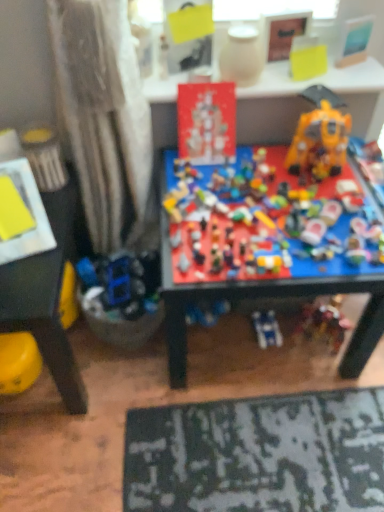
Question: From the image's perspective, is yellow plastic toy at lower left, arranged as the 2th table when viewed from the top, positioned above or below metallic yellow can at left, which is counted as the 1th toy, starting from the left?

Choices:
 (A) above
 (B) below

Answer: (B)

Question: In the image, is yellow plastic toy at lower left, which appears as the first table when ordered from the bottom, positioned in front of or behind metallic yellow can at left, the 6th toy viewed from the right?

Choices:
 (A) front
 (B) behind

Answer: (A)

Question: Which is nearer to the yellow matte paper at upper center, positioned as the 5th toy in left-to-right order?

Choices:
 (A) matte red poster at center, the fifth toy in the right-to-left sequence
 (B) multicolored plastic toys at center, which appears as the fourth toy when viewed from the left
 (C) shiny yellow plastic robot at upper right, acting as the sixth toy starting from the left
 (D) yellow plastic toy at lower left, which appears as the first table when ordered from the bottom
 (E) matte white vase at upper center, placed as the 3th toy when sorted from left to right

Answer: (E)

Question: Estimate the real-world distances between objects in this image. Which object is farther from the multicolored plastic toys at center, which appears as the fourth toy when viewed from the left?

Choices:
 (A) metallic yellow can at left, which is counted as the 1th toy, starting from the left
 (B) matte red poster at center, marked as the 2th toy in a left-to-right arrangement
 (C) matte white vase at upper center, placed as the 3th toy when sorted from left to right
 (D) yellow plastic toy at lower left, arranged as the 2th table when viewed from the top
 (E) matte white curtain at left

Answer: (A)